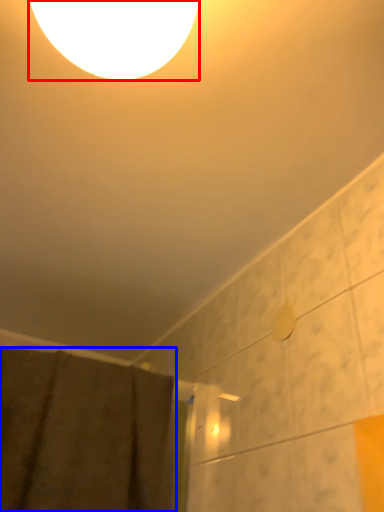
Question: Which object appears farthest to the camera in this image, lamp (highlighted by a red box) or shower curtain (highlighted by a blue box)?

Choices:
 (A) lamp
 (B) shower curtain

Answer: (B)